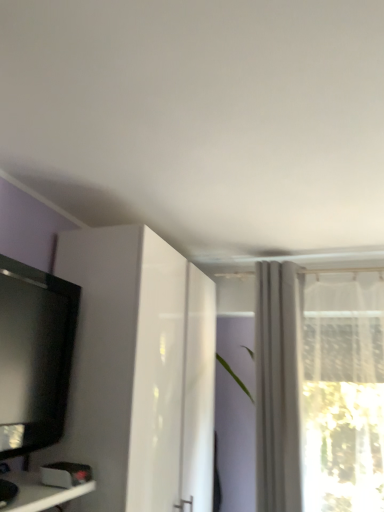
Question: From the image's perspective, relative to white glossy cabinet at left, is black glossy television at left above or below?

Choices:
 (A) below
 (B) above

Answer: (B)

Question: In terms of width, does black glossy television at left look wider or thinner when compared to white glossy cabinet at left?

Choices:
 (A) wide
 (B) thin

Answer: (B)

Question: Which object is the farthest from the white sheer curtain at upper right?

Choices:
 (A) white glossy cabinet at left
 (B) black glossy television at left

Answer: (B)

Question: Which object is positioned closest to the white sheer curtain at upper right?

Choices:
 (A) black glossy television at left
 (B) white glossy cabinet at left

Answer: (B)